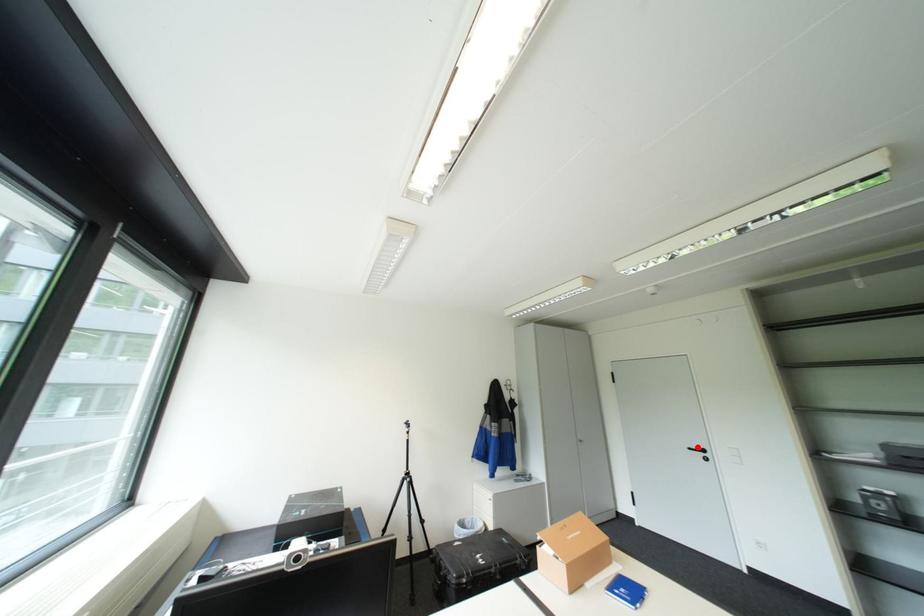
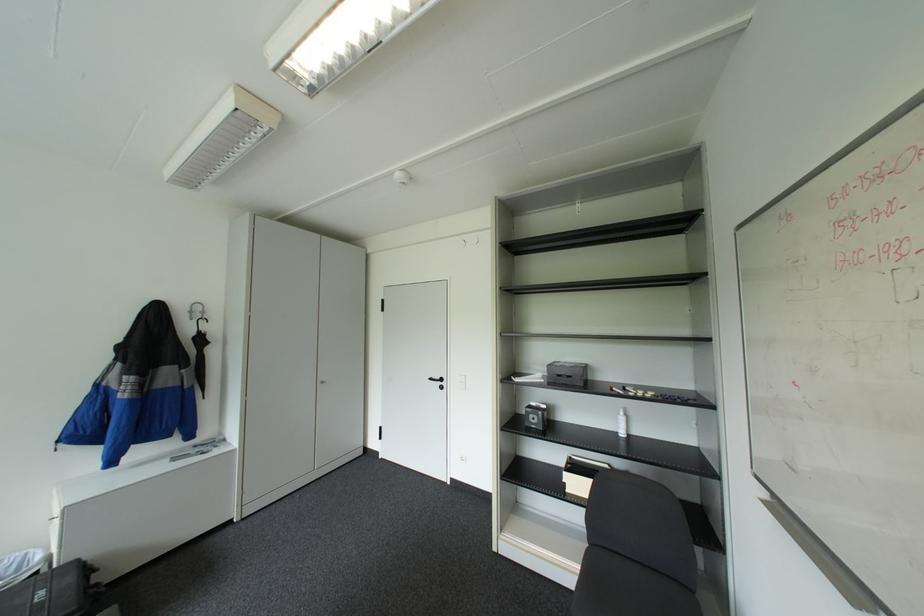
Locate, in the second image, the point that corresponds to the highlighted location in the first image.

(439, 378)